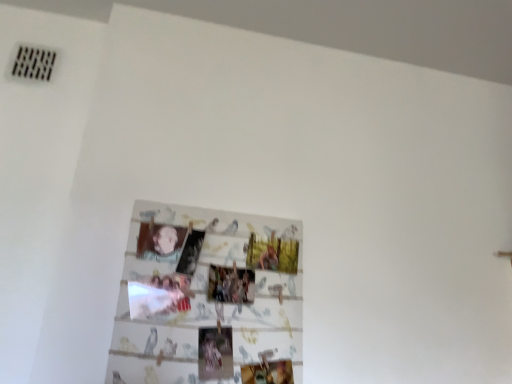
The width and height of the screenshot is (512, 384). What do you see at coordinates (160, 242) in the screenshot?
I see `smooth beige baby at center` at bounding box center [160, 242].

Where is `smooth beige baby at center`? This screenshot has width=512, height=384. smooth beige baby at center is located at coordinates (160, 242).

This screenshot has height=384, width=512. Describe the element at coordinates (209, 299) in the screenshot. I see `wooden photo collage at center` at that location.

At what (x,y) coordinates should I click in order to perform the action: click on wooden photo collage at center. Please return your answer as a coordinate pair (x, y). Image resolution: width=512 pixels, height=384 pixels. Looking at the image, I should click on (209, 299).

You are a GUI agent. You are given a task and a screenshot of the screen. Output one action in this format:
    pyautogui.click(x=<x>, y=<y>)
    Task: Click on the smooth beige baby at center
    This screenshot has width=512, height=384.
    Given the screenshot: What is the action you would take?
    pyautogui.click(x=160, y=242)

In the image, is smooth beige baby at center on the left side or the right side of wooden photo collage at center?

Based on their positions, smooth beige baby at center is located to the left of wooden photo collage at center.

Does smooth beige baby at center come in front of wooden photo collage at center?

No, smooth beige baby at center is further to the viewer.

Is point (143, 239) closer or farther from the camera than point (170, 355)?

Point (143, 239) appears to be farther away from the viewer than point (170, 355).

From the image's perspective, between smooth beige baby at center and wooden photo collage at center, which one is located above?

smooth beige baby at center, from the image's perspective.

From a real-world perspective, is smooth beige baby at center above or below wooden photo collage at center?

From a real-world perspective, smooth beige baby at center is physically above wooden photo collage at center.

Which object is thinner, smooth beige baby at center or wooden photo collage at center?

With smaller width is smooth beige baby at center.

Does smooth beige baby at center have a lesser height compared to wooden photo collage at center?

Yes.

Between smooth beige baby at center and wooden photo collage at center, which one has larger size?

wooden photo collage at center is bigger.

Do you think smooth beige baby at center is within wooden photo collage at center, or outside of it?

smooth beige baby at center is not enclosed by wooden photo collage at center.

Is smooth beige baby at center not close to wooden photo collage at center?

No, smooth beige baby at center is not far away from wooden photo collage at center.

Is smooth beige baby at center oriented towards wooden photo collage at center?

No, smooth beige baby at center does not turn towards wooden photo collage at center.

How different are the orientations of smooth beige baby at center and wooden photo collage at center in degrees?

The facing directions of smooth beige baby at center and wooden photo collage at center are 0.0159 degrees apart.

Find the location of a particular element. picture frame in front of the smooth beige baby at center is located at coordinates (209, 299).

Consider the image. Which is more to the left, wooden photo collage at center or smooth beige baby at center?

From the viewer's perspective, smooth beige baby at center appears more on the left side.

Does wooden photo collage at center lie behind smooth beige baby at center?

No, it is not.

Does point (225, 330) come closer to viewer compared to point (141, 252)?

Yes, point (225, 330) is in front of point (141, 252).

From the image's perspective, which is above, wooden photo collage at center or smooth beige baby at center?

smooth beige baby at center, from the image's perspective.

From a real-world perspective, is wooden photo collage at center positioned over smooth beige baby at center based on gravity?

No, from a real-world perspective, wooden photo collage at center is not above smooth beige baby at center.

Considering the relative sizes of wooden photo collage at center and smooth beige baby at center in the image provided, is wooden photo collage at center thinner than smooth beige baby at center?

In fact, wooden photo collage at center might be wider than smooth beige baby at center.

Considering the sizes of objects wooden photo collage at center and smooth beige baby at center in the image provided, who is shorter, wooden photo collage at center or smooth beige baby at center?

Standing shorter between the two is smooth beige baby at center.

Is wooden photo collage at center bigger than smooth beige baby at center?

Indeed, wooden photo collage at center has a larger size compared to smooth beige baby at center.

Choose the correct answer: Is wooden photo collage at center inside smooth beige baby at center or outside it?

wooden photo collage at center is outside smooth beige baby at center.

Is wooden photo collage at center far away from smooth beige baby at center?

Actually, wooden photo collage at center and smooth beige baby at center are a little close together.

Is wooden photo collage at center positioned with its back to smooth beige baby at center?

Yes, wooden photo collage at center is positioned with its back facing smooth beige baby at center.

The image size is (512, 384). I want to click on picture frame located on the right of smooth beige baby at center, so click(x=209, y=299).

Find the location of `person behind the wooden photo collage at center`. person behind the wooden photo collage at center is located at coordinates (160, 242).

You are a GUI agent. You are given a task and a screenshot of the screen. Output one action in this format:
    pyautogui.click(x=<x>, y=<y>)
    Task: Click on the picture frame below the smooth beige baby at center (from the image's perspective)
    This screenshot has height=384, width=512.
    Given the screenshot: What is the action you would take?
    pyautogui.click(x=209, y=299)